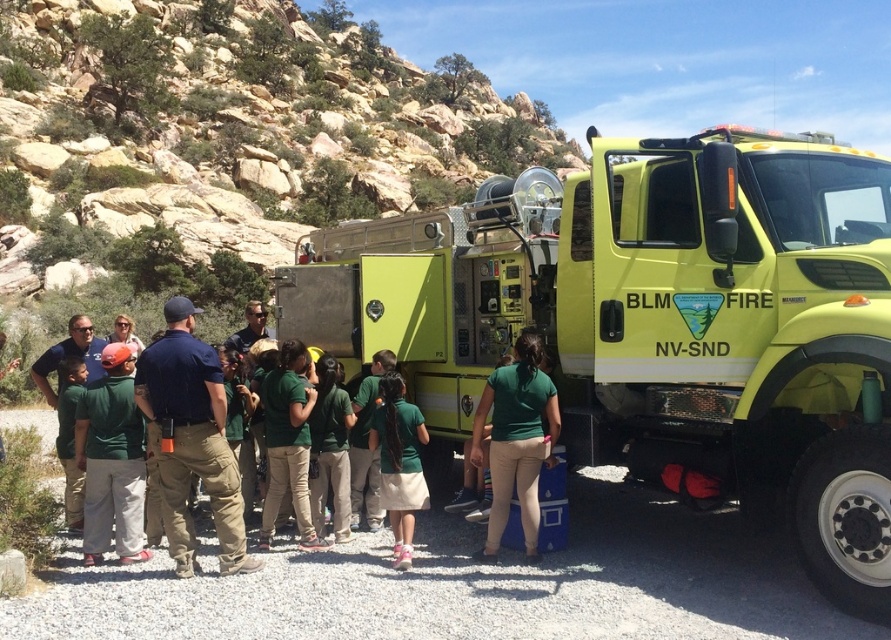
You are a photographer standing 10 feet away from the group. You want to take a photo that includes both the green cotton shirt at center and the green uniform shirt at left. Can you fit both shirts into the frame of your camera, which has a maximum horizontal field of view of 15 inches?

The green cotton shirt at center is 20.06 inches away from the green uniform shirt at left. Since the distance between them exceeds the camera frame limit of 15 inches, you cannot fit both shirts into the frame.

You are a photographer trying to capture a clear photo of the matte yellow fire truck at center and the green matte shirt at center. Since the fire truck is larger, where should you position yourself relative to the two objects to ensure both fit in the frame?

Since the matte yellow fire truck at center is larger than the green matte shirt at center, you should position yourself further away from both objects to ensure the entire fire truck fits in the frame while still capturing the green matte shirt at center clearly.

You are standing at the origin point of the coordinate system in the image. You want to move towards the green cotton shirt at center. Which direction should you move in?

The green cotton shirt at center is located at coordinate point (111,460). Since the origin is at the bottom left corner of the image, moving towards the right and slightly upwards would lead you to the green cotton shirt at center.